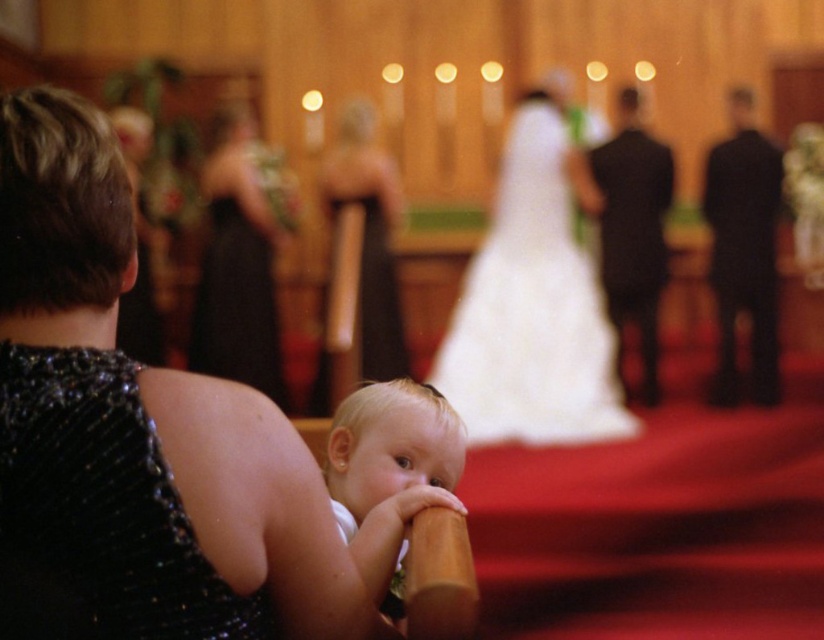
Which is in front, point (579, 282) or point (363, 296)?

Point (363, 296) is in front.

The width and height of the screenshot is (824, 640). What do you see at coordinates (534, 301) in the screenshot?
I see `white satin dress at center` at bounding box center [534, 301].

The width and height of the screenshot is (824, 640). In order to click on white satin dress at center in this screenshot , I will do click(x=534, y=301).

In the scene shown: Who is positioned more to the right, white satin dress at center or black satin dress at upper left?

white satin dress at center

Measure the distance between white satin dress at center and black satin dress at upper left.

white satin dress at center is 5.39 feet from black satin dress at upper left.

Does point (560, 284) come closer to viewer compared to point (195, 337)?

Yes, point (560, 284) is closer to viewer.

You are a GUI agent. You are given a task and a screenshot of the screen. Output one action in this format:
    pyautogui.click(x=<x>, y=<y>)
    Task: Click on the white satin dress at center
    This screenshot has width=824, height=640.
    Given the screenshot: What is the action you would take?
    pyautogui.click(x=534, y=301)

Describe the element at coordinates (134, 435) in the screenshot. I see `sparkly black dress at lower left` at that location.

Locate an element on the screen. sparkly black dress at lower left is located at coordinates (134, 435).